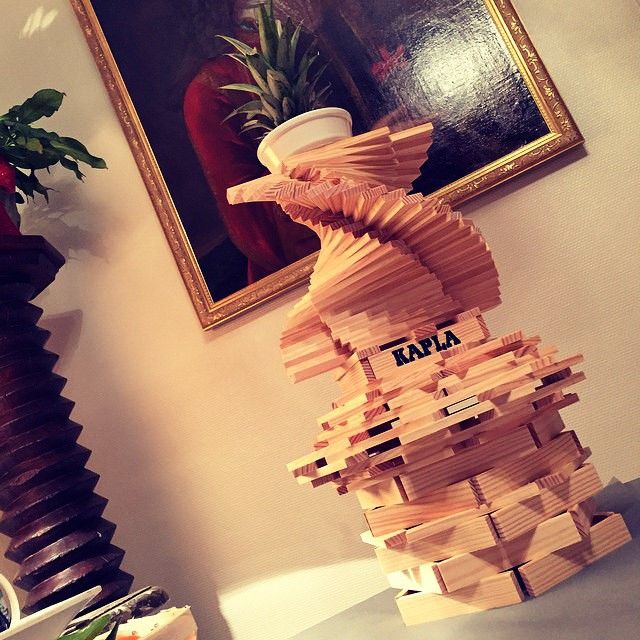
The image size is (640, 640). In order to click on plant leaves in this screenshot , I will do `click(25, 143)`.